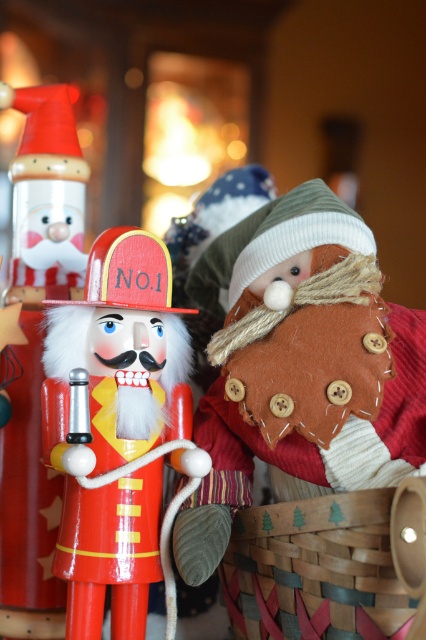
You are setting up a holiday display and want to place the brown felt santa at center and the wooden nutcracker at left on a shelf. The shelf has limited space. Based on their widths, which one should you place first to maximize shelf usage?

The brown felt santa at center might be wider than the wooden nutcracker at left, so placing the wider one first could help maximize shelf space.

You are standing in front of the festive holiday scene and need to place a new decoration between the wooden nutcracker at left and the gingerbread man figure. According to their positions, where should you place the new decoration?

The wooden nutcracker at left is located at point (x=36, y=353), so you should place the new decoration between these coordinates and the gingerbread man figure to the right.

You are a child trying to reach both the brown felt santa at center and the wooden nutcracker at left. Which one is lower and easier to reach?

The brown felt santa at center is below the wooden nutcracker at left, so it is lower and easier to reach.